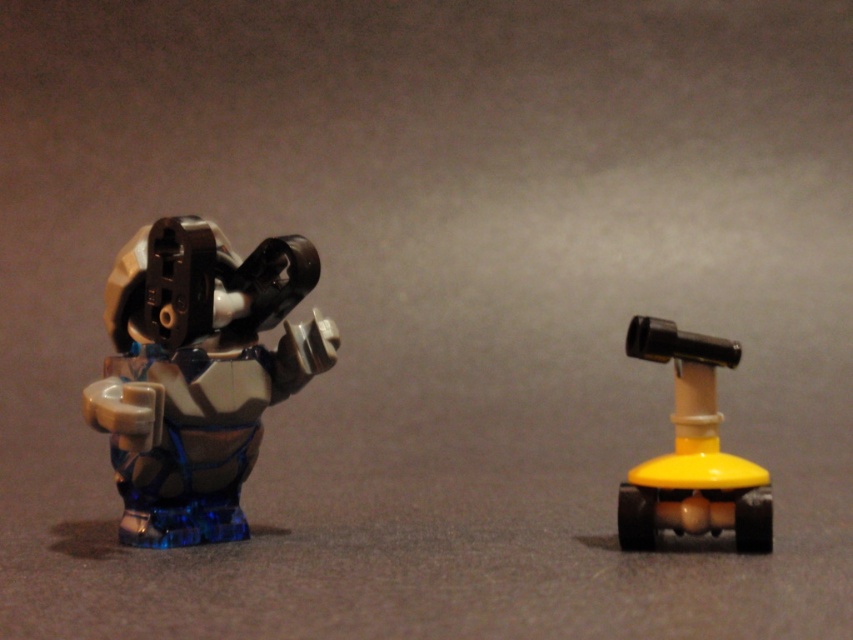
You are a drone operator trying to navigate between two points in the image. The first point is at coordinates point (109, 449) and the second point is at point (647, 321). According to the image, which point is closer to the front?

Point (647, 321) is closer to the front than point (109, 449).

You are an astronaut on a space mission and need to determine the order of objects from closest to farthest from your viewpoint. Which object is closer to you between the translucent blue plastic robot at left and the yellow matte telescope at right?

The translucent blue plastic robot at left is closer to you because it is positioned in front of the yellow matte telescope at right.

You are a toy organizer who needs to place the translucent blue plastic robot at left and yellow matte telescope at right on a shelf. The shelf has a width of 14 inches. Can both items fit side by side without overlapping?

The translucent blue plastic robot at left is 14.15 inches away from yellow matte telescope at right, which means the distance between them is greater than the shelf width of 14 inches. Therefore, the two items cannot fit side by side on the shelf without overlapping.